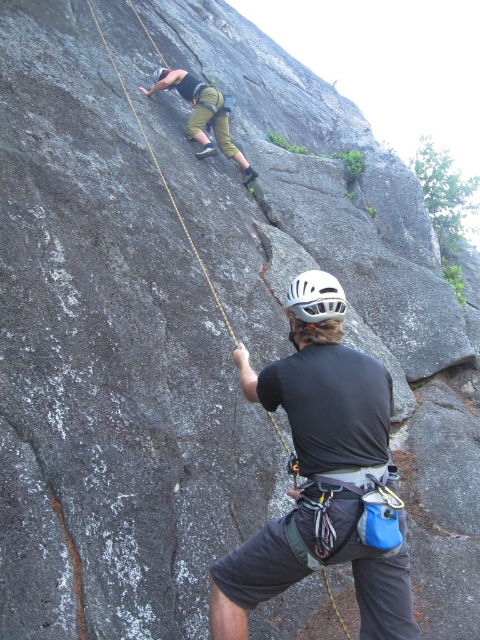
Question: Which of the following is the farthest from the observer?

Choices:
 (A) black fabric helmet at upper center
 (B) green fabric pants at upper center
 (C) white matte helmet at center

Answer: (B)

Question: Is black fabric helmet at upper center positioned before white matte helmet at center?

Choices:
 (A) no
 (B) yes

Answer: (B)

Question: Which point is closer to the camera?

Choices:
 (A) green fabric pants at upper center
 (B) white matte helmet at center

Answer: (B)

Question: Which of the following is the farthest from the observer?

Choices:
 (A) click(201, 113)
 (B) click(255, 392)

Answer: (A)

Question: Can you confirm if black fabric helmet at upper center is positioned below green fabric pants at upper center?

Choices:
 (A) yes
 (B) no

Answer: (A)

Question: Observing the image, what is the correct spatial positioning of green fabric pants at upper center in reference to white matte helmet at center?

Choices:
 (A) right
 (B) left

Answer: (B)